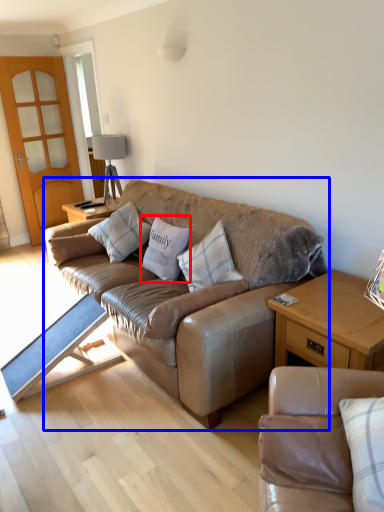
Question: Which of the following is the farthest to the observer, pillow (highlighted by a red box) or studio couch (highlighted by a blue box)?

Choices:
 (A) pillow
 (B) studio couch

Answer: (A)